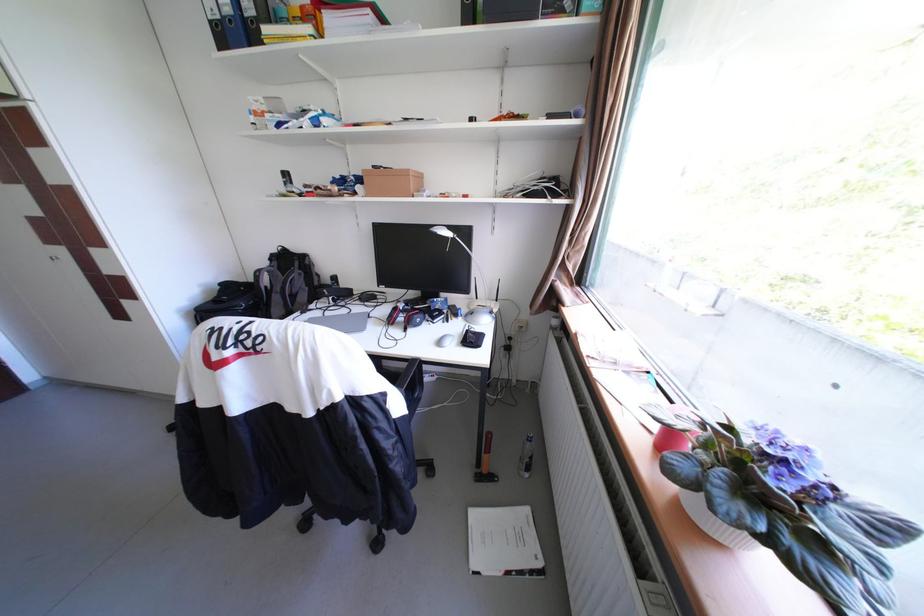
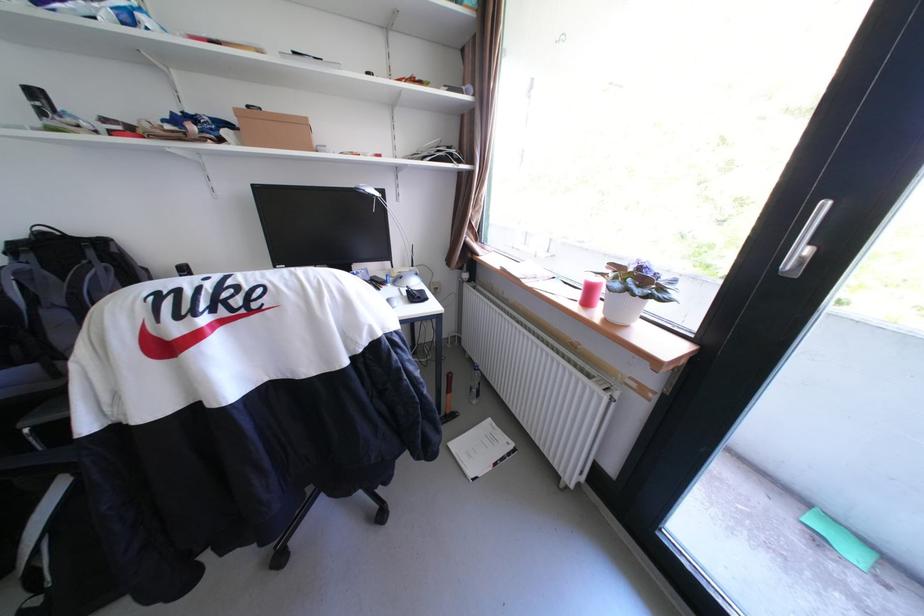
Where in the second image is the point corresponding to pixel 374 172 from the first image?

(247, 111)